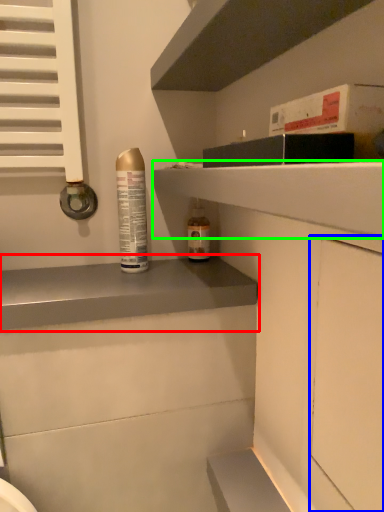
Question: Estimate the real-world distances between objects in this image. Which object is closer to shelf (highlighted by a red box), screen door (highlighted by a blue box) or shelf (highlighted by a green box)?

Choices:
 (A) screen door
 (B) shelf

Answer: (B)